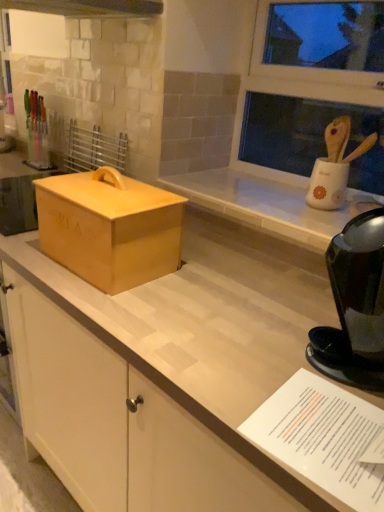
The image size is (384, 512). What do you see at coordinates (322, 437) in the screenshot?
I see `white paper at lower right` at bounding box center [322, 437].

Image resolution: width=384 pixels, height=512 pixels. Describe the element at coordinates (354, 306) in the screenshot. I see `black glossy coffee maker at right` at that location.

Describe the element at coordinates (109, 228) in the screenshot. This screenshot has width=384, height=512. I see `matte yellow box at center` at that location.

Locate an element on the screen. white paper at lower right is located at coordinates (322, 437).

Is matte yellow box at center touching black glossy coffee maker at right?

No, matte yellow box at center is not making contact with black glossy coffee maker at right.

Looking at this image, considering the sizes of objects matte yellow box at center and black glossy coffee maker at right in the image provided, who is taller, matte yellow box at center or black glossy coffee maker at right?

black glossy coffee maker at right is taller.

Is matte yellow box at center not inside black glossy coffee maker at right?

That's correct, matte yellow box at center is outside of black glossy coffee maker at right.

I want to click on box that appears on the left of black glossy coffee maker at right, so click(109, 228).

Can you confirm if black glossy coffee maker at right is smaller than matte yellow box at center?

Yes.

Is black glossy coffee maker at right shorter than matte yellow box at center?

Incorrect, the height of black glossy coffee maker at right does not fall short of that of matte yellow box at center.

In the scene shown: Is the position of black glossy coffee maker at right more distant than that of matte yellow box at center?

No, black glossy coffee maker at right is in front of matte yellow box at center.

Who is shorter, black glossy coffee maker at right or white paper at lower right?

With less height is white paper at lower right.

Locate an element on the screen. appliance on the right of white paper at lower right is located at coordinates (354, 306).

How distant is black glossy coffee maker at right from white paper at lower right?

black glossy coffee maker at right and white paper at lower right are 5.84 inches apart from each other.

Can we say black glossy coffee maker at right lies outside white paper at lower right?

black glossy coffee maker at right lies outside white paper at lower right's area.

From the picture: Is white paper at lower right at the back of matte yellow box at center?

matte yellow box at center is not turned away from white paper at lower right.

Consider the image. From a real-world perspective, which object rests below the other?

white paper at lower right, from a real-world perspective.

Does matte yellow box at center come behind white paper at lower right?

Yes, matte yellow box at center is further from the camera.

Consider the image. Considering the relative sizes of matte yellow box at center and white paper at lower right in the image provided, is matte yellow box at center wider than white paper at lower right?

Indeed, matte yellow box at center has a greater width compared to white paper at lower right.

Is white paper at lower right far from matte yellow box at center?

Actually, white paper at lower right and matte yellow box at center are a little close together.

Could matte yellow box at center be considered to be inside white paper at lower right?

No, matte yellow box at center is located outside of white paper at lower right.

Between white paper at lower right and matte yellow box at center, which one has less height?

white paper at lower right.

Identify the location of box on the left of white paper at lower right. (109, 228).

Is white paper at lower right not close to black glossy coffee maker at right?

No, white paper at lower right is not far away from black glossy coffee maker at right.

Can you confirm if white paper at lower right is thinner than black glossy coffee maker at right?

No.

From the image's perspective, which is above, white paper at lower right or black glossy coffee maker at right?

black glossy coffee maker at right.

You are a GUI agent. You are given a task and a screenshot of the screen. Output one action in this format:
    pyautogui.click(x=<x>, y=<y>)
    Task: Click on the box located behind the black glossy coffee maker at right
    The image size is (384, 512).
    Given the screenshot: What is the action you would take?
    pyautogui.click(x=109, y=228)

Where is `appliance to the right of matte yellow box at center`? appliance to the right of matte yellow box at center is located at coordinates (354, 306).

Looking at the image, which one is located closer to matte yellow box at center, white paper at lower right or black glossy coffee maker at right?

black glossy coffee maker at right.

Estimate the real-world distances between objects in this image. Which object is closer to black glossy coffee maker at right, white paper at lower right or matte yellow box at center?

Based on the image, white paper at lower right appears to be nearer to black glossy coffee maker at right.

Considering their positions, is black glossy coffee maker at right positioned further to matte yellow box at center than white paper at lower right?

white paper at lower right lies further to matte yellow box at center than the other object.

Based on their spatial positions, is matte yellow box at center or white paper at lower right further from black glossy coffee maker at right?

matte yellow box at center is further to black glossy coffee maker at right.

Looking at the image, which one is located closer to white paper at lower right, black glossy coffee maker at right or matte yellow box at center?

Based on the image, black glossy coffee maker at right appears to be nearer to white paper at lower right.

Estimate the real-world distances between objects in this image. Which object is further from white paper at lower right, matte yellow box at center or black glossy coffee maker at right?

Among the two, matte yellow box at center is located further to white paper at lower right.

Image resolution: width=384 pixels, height=512 pixels. I want to click on paper between matte yellow box at center and black glossy coffee maker at right, so click(x=322, y=437).